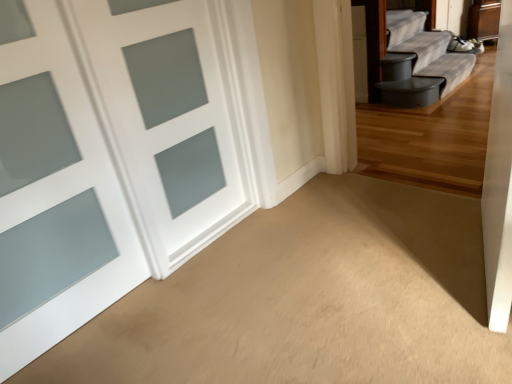
Question: Is white frosted glass door at left, placed as the 1th door when sorted from right to left, positioned before satin white door at left, the first door in the left-to-right sequence?

Choices:
 (A) no
 (B) yes

Answer: (A)

Question: Does white frosted glass door at left, placed as the 1th door when sorted from right to left, appear on the left side of satin white door at left, acting as the second door starting from the right?

Choices:
 (A) yes
 (B) no

Answer: (B)

Question: From a real-world perspective, is white frosted glass door at left, which is the 2th door from left to right, positioned over satin white door at left, acting as the second door starting from the right, based on gravity?

Choices:
 (A) no
 (B) yes

Answer: (A)

Question: Is white frosted glass door at left, which is the 2th door from left to right, outside satin white door at left, the first door in the left-to-right sequence?

Choices:
 (A) yes
 (B) no

Answer: (A)

Question: From the image's perspective, is white frosted glass door at left, which is the 2th door from left to right, under satin white door at left, the first door in the left-to-right sequence?

Choices:
 (A) yes
 (B) no

Answer: (B)

Question: Can you confirm if white frosted glass door at left, placed as the 1th door when sorted from right to left, is smaller than satin white door at left, acting as the second door starting from the right?

Choices:
 (A) no
 (B) yes

Answer: (A)

Question: From the image's perspective, would you say satin white door at left, the first door in the left-to-right sequence, is shown under white frosted glass door at left, which is the 2th door from left to right?

Choices:
 (A) yes
 (B) no

Answer: (A)

Question: Does satin white door at left, acting as the second door starting from the right, have a larger size compared to white frosted glass door at left, which is the 2th door from left to right?

Choices:
 (A) no
 (B) yes

Answer: (A)

Question: Considering the relative sizes of satin white door at left, acting as the second door starting from the right, and white frosted glass door at left, which is the 2th door from left to right, in the image provided, is satin white door at left, acting as the second door starting from the right, smaller than white frosted glass door at left, which is the 2th door from left to right,?

Choices:
 (A) yes
 (B) no

Answer: (A)

Question: Is satin white door at left, the first door in the left-to-right sequence, beside white frosted glass door at left, which is the 2th door from left to right?

Choices:
 (A) no
 (B) yes

Answer: (A)

Question: From a real-world perspective, is satin white door at left, the first door in the left-to-right sequence, on white frosted glass door at left, which is the 2th door from left to right?

Choices:
 (A) yes
 (B) no

Answer: (A)

Question: Can you confirm if satin white door at left, the first door in the left-to-right sequence, is shorter than white frosted glass door at left, placed as the 1th door when sorted from right to left?

Choices:
 (A) yes
 (B) no

Answer: (B)

Question: Based on their positions, is white frosted glass door at left, which is the 2th door from left to right, located to the left or right of satin white door at left, acting as the second door starting from the right?

Choices:
 (A) right
 (B) left

Answer: (A)